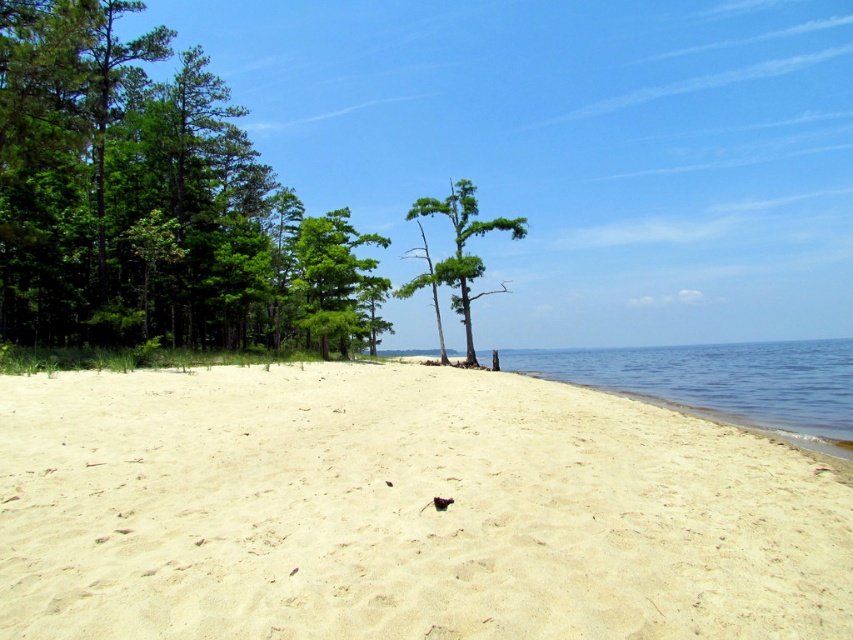
Question: Can you confirm if clear blue water at lower right is bigger than green leafy tree at center?

Choices:
 (A) no
 (B) yes

Answer: (A)

Question: Which of the following is the closest to the observer?

Choices:
 (A) (563, 609)
 (B) (820, 410)

Answer: (A)

Question: Does clear blue water at lower right have a larger size compared to green leafy tree at center?

Choices:
 (A) no
 (B) yes

Answer: (A)

Question: Which point is closer to the camera?

Choices:
 (A) (447, 268)
 (B) (292, 365)

Answer: (B)

Question: Which of these objects is positioned farthest from the green leafy trees at left?

Choices:
 (A) white sandy beach at center
 (B) green leafy tree at center

Answer: (A)

Question: Is white sandy beach at center to the right of green leafy tree at center from the viewer's perspective?

Choices:
 (A) no
 (B) yes

Answer: (A)